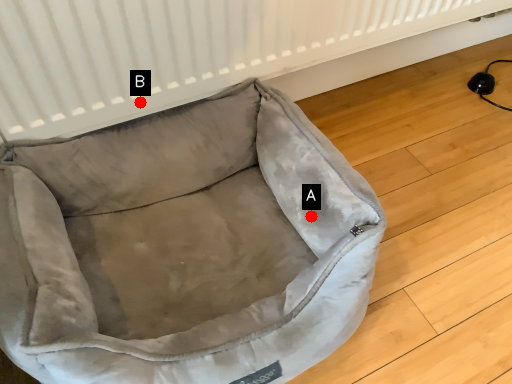
Question: Two points are circled on the image, labeled by A and B beside each circle. Among these points, which one is farthest from the camera?

Choices:
 (A) A is further
 (B) B is further

Answer: (B)